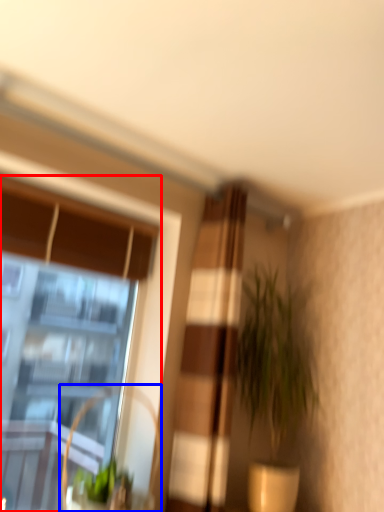
Question: Which object is closer to the camera taking this photo, window (highlighted by a red box) or swivel chair (highlighted by a blue box)?

Choices:
 (A) window
 (B) swivel chair

Answer: (B)